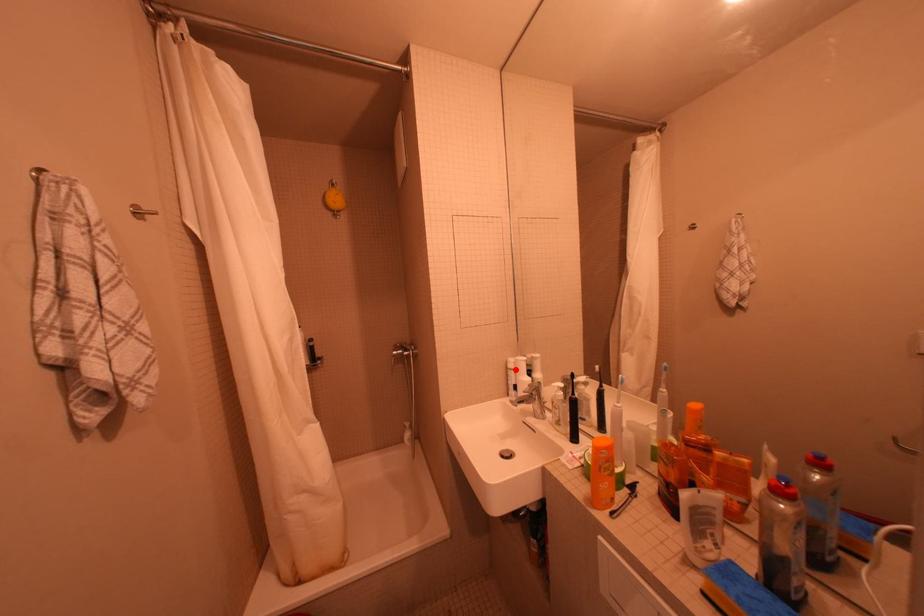
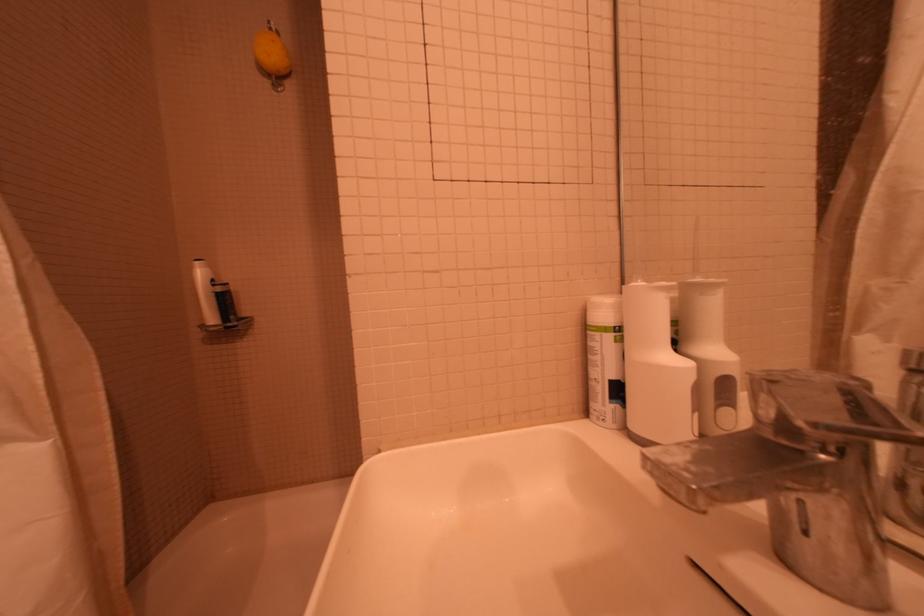
Find the pixel in the second image that matches the highlighted location in the first image.

(593, 330)